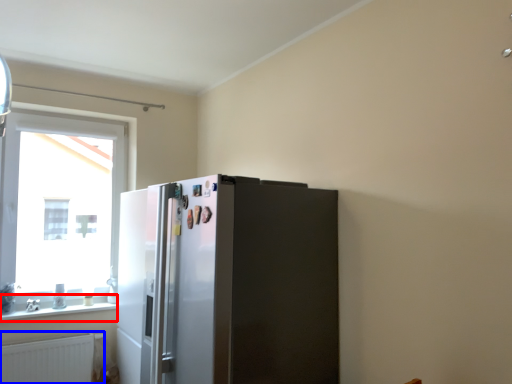
Question: Which object appears farthest to the camera in this image, window sill (highlighted by a red box) or radiator (highlighted by a blue box)?

Choices:
 (A) window sill
 (B) radiator

Answer: (A)